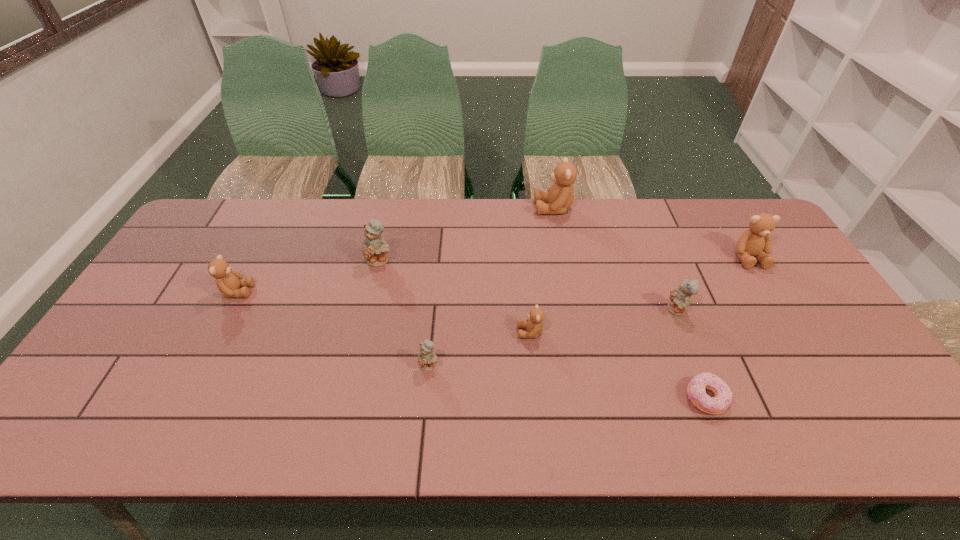
Identify the location of vacant area situated 0.170m on the face of the third smallest brown teddy bear. The width and height of the screenshot is (960, 540). (783, 314).

You are a GUI agent. You are given a task and a screenshot of the screen. Output one action in this format:
    pyautogui.click(x=<x>, y=<y>)
    Task: Click on the free spot located on the front-facing side of the second biggest blue teddy bear
    This screenshot has width=960, height=540.
    Given the screenshot: What is the action you would take?
    pyautogui.click(x=573, y=310)

This screenshot has width=960, height=540. In order to click on vacant position located on the front-facing side of the second biggest blue teddy bear in this screenshot , I will do `click(624, 310)`.

The width and height of the screenshot is (960, 540). Identify the location of free spot located on the front-facing side of the second biggest blue teddy bear. (544, 310).

Where is `free location located on the face of the leftmost object`? This screenshot has height=540, width=960. free location located on the face of the leftmost object is located at coordinates (356, 291).

What are the coordinates of `vacant area situated on the face of the fourth teddy bear from right to left` in the screenshot? It's located at (443, 333).

The width and height of the screenshot is (960, 540). What are the coordinates of `vacant space situated on the face of the fourth teddy bear from right to left` in the screenshot? It's located at (378, 333).

The width and height of the screenshot is (960, 540). What are the coordinates of `vacant space located on the face of the fourth teddy bear from right to left` in the screenshot? It's located at (412, 333).

Identify the location of blank space located on the front-facing side of the smallest blue teddy bear. coord(423,430).

At what (x,y) coordinates should I click in order to perform the action: click on vacant space situated 0.060m on the front of the shortest object. Please return your answer as a coordinate pair (x, y). This screenshot has height=540, width=960. Looking at the image, I should click on (723, 443).